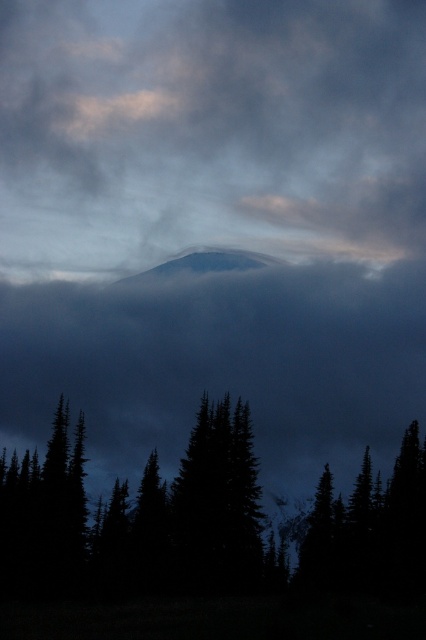
Between translucent fog at center and dark green textured tree at center, which one is positioned lower?

dark green textured tree at center is lower down.

Does translucent fog at center appear on the left side of dark green textured tree at center?

In fact, translucent fog at center is to the right of dark green textured tree at center.

Which is behind, point (69, 236) or point (230, 419)?

Positioned behind is point (69, 236).

I want to click on translucent fog at center, so 210,129.

Who is positioned more to the right, smokey gray cloud at center or white snow-covered mountain at center?

white snow-covered mountain at center is more to the right.

Which is more to the left, smokey gray cloud at center or white snow-covered mountain at center?

Positioned to the left is smokey gray cloud at center.

Does point (126, 449) come farther from viewer compared to point (198, 262)?

No, it is in front of (198, 262).

Where is `smokey gray cloud at center`? The image size is (426, 640). smokey gray cloud at center is located at coordinates (221, 364).

Between translucent fog at center and white snow-covered mountain at center, which one appears on the right side from the viewer's perspective?

translucent fog at center

Is translucent fog at center below white snow-covered mountain at center?

Actually, translucent fog at center is above white snow-covered mountain at center.

Who is more distant from viewer, (x=397, y=221) or (x=129, y=276)?

Positioned behind is point (x=397, y=221).

This screenshot has width=426, height=640. Find the location of `translucent fog at center`. translucent fog at center is located at coordinates (210, 129).